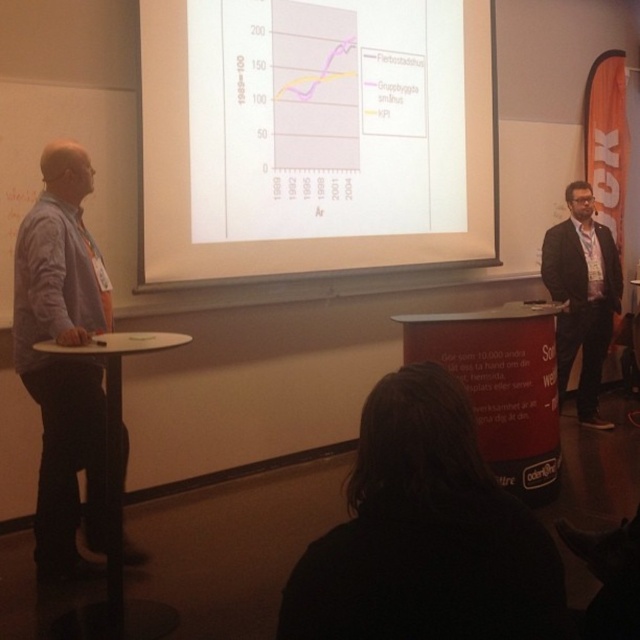
Question: Which point appears farthest from the camera in this image?

Choices:
 (A) (196, 3)
 (B) (97, 497)

Answer: (A)

Question: Which object is closer to the camera taking this photo?

Choices:
 (A) black suit at right
 (B) black fabric at lower center
 (C) blue shirt at left
 (D) white paper at center

Answer: (B)

Question: Can you confirm if black fabric at lower center is positioned below blue shirt at left?

Choices:
 (A) no
 (B) yes

Answer: (B)

Question: Considering the relative positions of white paper at center and black fabric at lower center in the image provided, where is white paper at center located with respect to black fabric at lower center?

Choices:
 (A) above
 (B) below

Answer: (A)

Question: Which of the following is the farthest from the observer?

Choices:
 (A) (266, 120)
 (B) (99, 385)

Answer: (A)

Question: Can you confirm if white paper at center is positioned to the right of black suit at right?

Choices:
 (A) no
 (B) yes

Answer: (A)